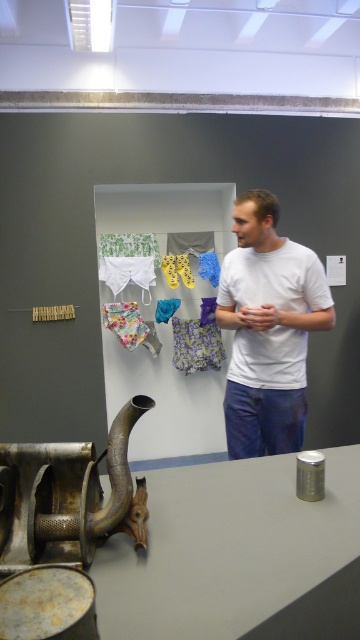
Can you confirm if white matte t-shirt at center is shorter than floral fabric underwear at center?

No, white matte t-shirt at center is not shorter than floral fabric underwear at center.

Is point (230, 444) more distant than point (200, 328)?

That is False.

Is point (298, 396) more distant than point (201, 355)?

No, it is not.

Identify the location of white matte t-shirt at center. (267, 330).

Does rusty metal sculpture at lower left have a smaller size compared to floral fabric underwear at center?

Actually, rusty metal sculpture at lower left might be larger than floral fabric underwear at center.

Which is more to the right, rusty metal sculpture at lower left or floral fabric underwear at center?

From the viewer's perspective, floral fabric underwear at center appears more on the right side.

What do you see at coordinates (69, 497) in the screenshot?
I see `rusty metal sculpture at lower left` at bounding box center [69, 497].

The width and height of the screenshot is (360, 640). In order to click on rusty metal sculpture at lower left in this screenshot , I will do `click(69, 497)`.

Is white matte t-shirt at center further to camera compared to rusty metal sculpture at lower left?

Yes, white matte t-shirt at center is behind rusty metal sculpture at lower left.

Does white matte t-shirt at center have a greater height compared to rusty metal sculpture at lower left?

Yes.

Does point (254, 220) come closer to viewer compared to point (111, 445)?

No, it is not.

I want to click on white matte t-shirt at center, so [x=267, y=330].